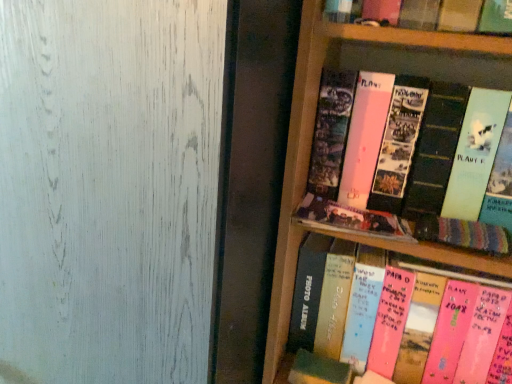
I want to click on transparent frosted glass at upper left, so click(109, 189).

This screenshot has height=384, width=512. Describe the element at coordinates (464, 234) in the screenshot. I see `knitted fabric book at right, which appears as the second book when ordered from the bottom` at that location.

Locate an element on the screen. The image size is (512, 384). pink paper photo album at center, which ranks as the fourth book in top-to-bottom order is located at coordinates (333, 298).

The height and width of the screenshot is (384, 512). Describe the element at coordinates (333, 298) in the screenshot. I see `pink paper photo album at center, the first book in the bottom-to-top sequence` at that location.

What do you see at coordinates (351, 219) in the screenshot? I see `matte black photo album at center, marked as the third book in a bottom-to-top arrangement` at bounding box center [351, 219].

You are a GUI agent. You are given a task and a screenshot of the screen. Output one action in this format:
    pyautogui.click(x=<x>, y=<y>)
    Task: Click on the transparent frosted glass at upper left
    Image resolution: width=512 pixels, height=384 pixels.
    Given the screenshot: What is the action you would take?
    (x=109, y=189)

From a real-world perspective, is pink paper photo album at center, the first book in the bottom-to-top sequence, on top of knitted fabric book at right, which is the third book in top-to-bottom order?

No.

Who is smaller, pink paper photo album at center, the first book in the bottom-to-top sequence, or knitted fabric book at right, which appears as the second book when ordered from the bottom?

With smaller size is knitted fabric book at right, which appears as the second book when ordered from the bottom.

From a real-world perspective, which book is the 2nd one above the pink paper photo album at center, the first book in the bottom-to-top sequence? Please provide its 2D coordinates.

[(464, 234)]

Does pink paper photo album at center, which ranks as the fourth book in top-to-bottom order, have a greater width compared to knitted fabric book at right, which is the third book in top-to-bottom order?

Indeed, pink paper photo album at center, which ranks as the fourth book in top-to-bottom order, has a greater width compared to knitted fabric book at right, which is the third book in top-to-bottom order.

Is transparent frosted glass at upper left bigger than matte black photo album at center, marked as the third book in a bottom-to-top arrangement?

Correct, transparent frosted glass at upper left is larger in size than matte black photo album at center, marked as the third book in a bottom-to-top arrangement.

From a real-world perspective, is transparent frosted glass at upper left below matte black photo album at center, which appears as the second book when viewed from the top?

Indeed, from a real-world perspective, transparent frosted glass at upper left is positioned beneath matte black photo album at center, which appears as the second book when viewed from the top.

Is transparent frosted glass at upper left not within matte black photo album at center, which appears as the second book when viewed from the top?

Yes.

How different are the orientations of transparent frosted glass at upper left and matte black photo album at center, which appears as the second book when viewed from the top, in degrees?

There is a 0.0715-degree angle between the facing directions of transparent frosted glass at upper left and matte black photo album at center, which appears as the second book when viewed from the top.

Starting from the transparent frosted glass at upper left, which book is the 3rd one behind? Please provide its 2D coordinates.

[(351, 219)]

From the picture: Between matte black photo album at center, which appears as the second book when viewed from the top, and transparent frosted glass at upper left, which one appears on the left side from the viewer's perspective?

Positioned to the left is transparent frosted glass at upper left.

Which is correct: matte black photo album at center, which appears as the second book when viewed from the top, is inside transparent frosted glass at upper left, or outside of it?

matte black photo album at center, which appears as the second book when viewed from the top, is not inside transparent frosted glass at upper left, it's outside.

Who is bigger, matte black photo album at center, which appears as the second book when viewed from the top, or transparent frosted glass at upper left?

transparent frosted glass at upper left is bigger.

Where is `the 3rd book above the transparent frosted glass at upper left (from the image's perspective)`? the 3rd book above the transparent frosted glass at upper left (from the image's perspective) is located at coordinates (408, 158).

Which is more to the left, transparent frosted glass at upper left or pink matte photo album at upper right, which is counted as the fourth book, starting from the bottom?

From the viewer's perspective, transparent frosted glass at upper left appears more on the left side.

From the image's perspective, which one is positioned lower, transparent frosted glass at upper left or pink matte photo album at upper right, acting as the 1th book starting from the top?

From the image's view, transparent frosted glass at upper left is below.

Is transparent frosted glass at upper left wider or thinner than pink matte photo album at upper right, which is counted as the fourth book, starting from the bottom?

Considering their sizes, transparent frosted glass at upper left looks broader than pink matte photo album at upper right, which is counted as the fourth book, starting from the bottom.

How many degrees apart are the facing directions of pink matte photo album at upper right, which is counted as the fourth book, starting from the bottom, and pink paper photo album at center, the first book in the bottom-to-top sequence?

The angular difference between pink matte photo album at upper right, which is counted as the fourth book, starting from the bottom, and pink paper photo album at center, the first book in the bottom-to-top sequence, is 9.53e-05 degrees.

Is pink matte photo album at upper right, acting as the 1th book starting from the top, next to pink paper photo album at center, the first book in the bottom-to-top sequence?

No, pink matte photo album at upper right, acting as the 1th book starting from the top, is not touching pink paper photo album at center, the first book in the bottom-to-top sequence.

Considering the positions of point (442, 154) and point (352, 335), is point (442, 154) closer or farther from the camera than point (352, 335)?

Point (442, 154) is closer to the camera than point (352, 335).

From a real-world perspective, is pink matte photo album at upper right, which is counted as the fourth book, starting from the bottom, positioned over pink paper photo album at center, the first book in the bottom-to-top sequence, based on gravity?

Indeed, from a real-world perspective, pink matte photo album at upper right, which is counted as the fourth book, starting from the bottom, stands above pink paper photo album at center, the first book in the bottom-to-top sequence.

Which of these two, matte black photo album at center, which appears as the second book when viewed from the top, or knitted fabric book at right, which is the third book in top-to-bottom order, is wider?

knitted fabric book at right, which is the third book in top-to-bottom order.

Considering the relative positions of matte black photo album at center, marked as the third book in a bottom-to-top arrangement, and knitted fabric book at right, which appears as the second book when ordered from the bottom, in the image provided, is matte black photo album at center, marked as the third book in a bottom-to-top arrangement, to the left or to the right of knitted fabric book at right, which appears as the second book when ordered from the bottom,?

matte black photo album at center, marked as the third book in a bottom-to-top arrangement, is positioned on knitted fabric book at right, which appears as the second book when ordered from the bottom,'s left side.

Is matte black photo album at center, marked as the third book in a bottom-to-top arrangement, turned away from knitted fabric book at right, which is the third book in top-to-bottom order?

No.

From the picture: Which object is closer to the camera taking this photo, matte black photo album at center, which appears as the second book when viewed from the top, or knitted fabric book at right, which appears as the second book when ordered from the bottom?

Positioned in front is knitted fabric book at right, which appears as the second book when ordered from the bottom.

Looking at this image, is pink matte photo album at upper right, acting as the 1th book starting from the top, spatially inside transparent frosted glass at upper left, or outside of it?

pink matte photo album at upper right, acting as the 1th book starting from the top, exists outside the volume of transparent frosted glass at upper left.

Is pink matte photo album at upper right, which is counted as the fourth book, starting from the bottom, bigger than transparent frosted glass at upper left?

No.

This screenshot has height=384, width=512. I want to click on glass door below the pink matte photo album at upper right, acting as the 1th book starting from the top (from the image's perspective), so click(x=109, y=189).

From a real-world perspective, count 2nd books downward from the knitted fabric book at right, which appears as the second book when ordered from the bottom, and point to it. Please provide its 2D coordinates.

[(333, 298)]

Find the location of a particular element. The width and height of the screenshot is (512, 384). the 3rd book behind the transparent frosted glass at upper left is located at coordinates [x=351, y=219].

Estimate the real-world distances between objects in this image. Which object is further from pink matte photo album at upper right, which is counted as the fourth book, starting from the bottom, knitted fabric book at right, which is the third book in top-to-bottom order, or pink paper photo album at center, which ranks as the fourth book in top-to-bottom order?

pink paper photo album at center, which ranks as the fourth book in top-to-bottom order, lies further to pink matte photo album at upper right, which is counted as the fourth book, starting from the bottom, than the other object.

Estimate the real-world distances between objects in this image. Which object is further from matte black photo album at center, marked as the third book in a bottom-to-top arrangement, knitted fabric book at right, which is the third book in top-to-bottom order, or pink matte photo album at upper right, which is counted as the fourth book, starting from the bottom?

Among the two, pink matte photo album at upper right, which is counted as the fourth book, starting from the bottom, is located further to matte black photo album at center, marked as the third book in a bottom-to-top arrangement.

From the image, which object appears to be farther from matte black photo album at center, which appears as the second book when viewed from the top, pink paper photo album at center, which ranks as the fourth book in top-to-bottom order, or transparent frosted glass at upper left?

Based on the image, transparent frosted glass at upper left appears to be further to matte black photo album at center, which appears as the second book when viewed from the top.

When comparing their distances from matte black photo album at center, marked as the third book in a bottom-to-top arrangement, does pink matte photo album at upper right, which is counted as the fourth book, starting from the bottom, or pink paper photo album at center, which ranks as the fourth book in top-to-bottom order, seem closer?

pink matte photo album at upper right, which is counted as the fourth book, starting from the bottom, lies closer to matte black photo album at center, marked as the third book in a bottom-to-top arrangement, than the other object.

Based on their spatial positions, is matte black photo album at center, which appears as the second book when viewed from the top, or knitted fabric book at right, which appears as the second book when ordered from the bottom, further from transparent frosted glass at upper left?

knitted fabric book at right, which appears as the second book when ordered from the bottom, is positioned further to the anchor transparent frosted glass at upper left.

Based on the photo, which object lies further to the anchor point pink paper photo album at center, which ranks as the fourth book in top-to-bottom order, matte black photo album at center, which appears as the second book when viewed from the top, or transparent frosted glass at upper left?

transparent frosted glass at upper left is further to pink paper photo album at center, which ranks as the fourth book in top-to-bottom order.

Considering their positions, is knitted fabric book at right, which is the third book in top-to-bottom order, positioned further to pink matte photo album at upper right, which is counted as the fourth book, starting from the bottom, than transparent frosted glass at upper left?

transparent frosted glass at upper left is positioned further to the anchor pink matte photo album at upper right, which is counted as the fourth book, starting from the bottom.

From the picture: Which object lies further to the anchor point knitted fabric book at right, which appears as the second book when ordered from the bottom, transparent frosted glass at upper left or matte black photo album at center, which appears as the second book when viewed from the top?

transparent frosted glass at upper left lies further to knitted fabric book at right, which appears as the second book when ordered from the bottom, than the other object.

The image size is (512, 384). I want to click on book between transparent frosted glass at upper left and pink matte photo album at upper right, acting as the 1th book starting from the top, so click(x=351, y=219).